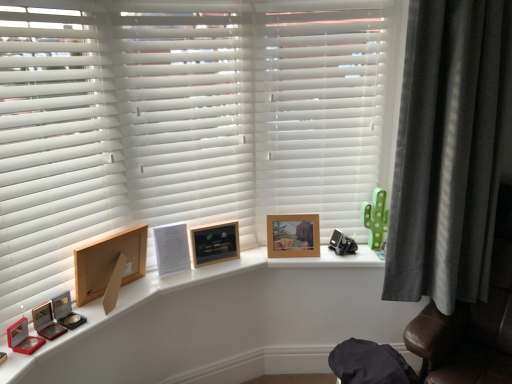
Measure the distance between white matte shutter at left, which ranks as the 3th shutter in right-to-left order, and camera.

A distance of 4.33 feet exists between white matte shutter at left, which ranks as the 3th shutter in right-to-left order, and camera.

The image size is (512, 384). What do you see at coordinates (187, 111) in the screenshot? I see `white matte blinds at center, acting as the 2th shutter starting from the right` at bounding box center [187, 111].

The image size is (512, 384). Describe the element at coordinates (215, 243) in the screenshot. I see `wooden photo frame at center, which appears as the second picture frame when viewed from the front` at that location.

What do you see at coordinates (375, 218) in the screenshot? I see `green polka dot cactus at right` at bounding box center [375, 218].

What is the approximate width of green polka dot cactus at right?

The width of green polka dot cactus at right is 2.47 inches.

Where is `dark grey velvet curtain at right`? This screenshot has width=512, height=384. dark grey velvet curtain at right is located at coordinates (449, 150).

Where is `white matte shutter at left, the 1th shutter from the left`? Image resolution: width=512 pixels, height=384 pixels. white matte shutter at left, the 1th shutter from the left is located at coordinates (52, 153).

Which of these two, dark grey velvet curtain at right or white matte shutter at upper center, arranged as the third shutter when viewed from the left, is smaller?

white matte shutter at upper center, arranged as the third shutter when viewed from the left.

This screenshot has width=512, height=384. I want to click on the 2nd shutter behind the dark grey velvet curtain at right, starting your count from the anchor, so click(320, 108).

Consider the image. From a real-world perspective, between dark grey velvet curtain at right and white matte shutter at upper center, arranged as the third shutter when viewed from the left, who is vertically lower?

dark grey velvet curtain at right is physically lower.

Would you consider dark grey velvet curtain at right to be distant from white matte shutter at upper center, arranged as the third shutter when viewed from the left?

No, dark grey velvet curtain at right is not far away from white matte shutter at upper center, arranged as the third shutter when viewed from the left.

Is white matte shutter at left, which ranks as the 3th shutter in right-to-left order, at the right side of brown leather swivel chair at right?

In fact, white matte shutter at left, which ranks as the 3th shutter in right-to-left order, is to the left of brown leather swivel chair at right.

From the image's perspective, is white matte shutter at left, which ranks as the 3th shutter in right-to-left order, above or below brown leather swivel chair at right?

white matte shutter at left, which ranks as the 3th shutter in right-to-left order, is situated higher than brown leather swivel chair at right in the image.

I want to click on swivel chair located below the white matte shutter at left, the 1th shutter from the left (from the image's perspective), so click(472, 322).

From a real-world perspective, is white matte shutter at left, the 1th shutter from the left, beneath brown leather swivel chair at right?

Incorrect, from a real-world perspective, white matte shutter at left, the 1th shutter from the left, is higher than brown leather swivel chair at right.

Starting from the wooden photo frame at center, which is the first picture frame in back-to-front order, which shutter is the 1st one in front? Please provide its 2D coordinates.

[(320, 108)]

From the picture: Does wooden photo frame at center, which appears as the third picture frame when viewed from the front, come behind white matte shutter at upper center, arranged as the third shutter when viewed from the left?

Yes, wooden photo frame at center, which appears as the third picture frame when viewed from the front, is further from the camera.

Between wooden photo frame at center, acting as the 3th picture frame starting from the left, and white matte shutter at upper center, arranged as the third shutter when viewed from the left, which one has smaller width?

wooden photo frame at center, acting as the 3th picture frame starting from the left, is thinner.

Who is bigger, wooden photo frame at center, which appears as the third picture frame when viewed from the front, or white matte shutter at upper center, arranged as the third shutter when viewed from the left?

With larger size is white matte shutter at upper center, arranged as the third shutter when viewed from the left.

Measure the distance between white matte shutter at upper center, the 1th shutter from the right, and dark grey velvet curtain at right.

white matte shutter at upper center, the 1th shutter from the right, is 14.99 inches away from dark grey velvet curtain at right.

Visually, is white matte shutter at upper center, arranged as the third shutter when viewed from the left, positioned to the left or to the right of dark grey velvet curtain at right?

In the image, white matte shutter at upper center, arranged as the third shutter when viewed from the left, appears on the left side of dark grey velvet curtain at right.

Where is `curtain below the white matte shutter at upper center, arranged as the third shutter when viewed from the left (from the image's perspective)`? curtain below the white matte shutter at upper center, arranged as the third shutter when viewed from the left (from the image's perspective) is located at coordinates (449, 150).

Is white matte shutter at upper center, arranged as the third shutter when viewed from the left, far from dark grey velvet curtain at right?

That's not correct — white matte shutter at upper center, arranged as the third shutter when viewed from the left, is a little close to dark grey velvet curtain at right.

Where is `computer desk below the wooden photo frame at center, the 2th picture frame from the right (from the image's perspective)`? The image size is (512, 384). computer desk below the wooden photo frame at center, the 2th picture frame from the right (from the image's perspective) is located at coordinates (221, 323).

Is wooden photo frame at center, the 2th picture frame from the right, aimed at wooden frame at upper center?

Yes, wooden photo frame at center, the 2th picture frame from the right, is oriented towards wooden frame at upper center.

Who is smaller, wooden photo frame at center, the second picture frame in the back-to-front sequence, or wooden frame at upper center?

With smaller size is wooden photo frame at center, the second picture frame in the back-to-front sequence.

Is wooden photo frame at center, the second picture frame in the left-to-right sequence, wider than wooden frame at upper center?

In fact, wooden photo frame at center, the second picture frame in the left-to-right sequence, might be narrower than wooden frame at upper center.

In the scene shown: Considering the relative sizes of wooden photo frame at center, which is the first picture frame in back-to-front order, and wooden photo frame at center, which appears as the second picture frame when viewed from the front, in the image provided, is wooden photo frame at center, which is the first picture frame in back-to-front order, shorter than wooden photo frame at center, which appears as the second picture frame when viewed from the front,?

Incorrect, the height of wooden photo frame at center, which is the first picture frame in back-to-front order, does not fall short of that of wooden photo frame at center, which appears as the second picture frame when viewed from the front.

Is wooden photo frame at center, the first picture frame positioned from the right, looking in the opposite direction of wooden photo frame at center, which appears as the second picture frame when viewed from the front?

No.

In the image, is wooden photo frame at center, acting as the 3th picture frame starting from the left, on the left side or the right side of wooden photo frame at center, which appears as the second picture frame when viewed from the front?

wooden photo frame at center, acting as the 3th picture frame starting from the left, is to the right of wooden photo frame at center, which appears as the second picture frame when viewed from the front.

Are wooden photo frame at center, which appears as the third picture frame when viewed from the front, and white matte shutter at left, the 1th shutter from the left, far apart?

No, there isn't a large distance between wooden photo frame at center, which appears as the third picture frame when viewed from the front, and white matte shutter at left, the 1th shutter from the left.

Does wooden photo frame at center, the first picture frame positioned from the right, have a lesser height compared to white matte shutter at left, which ranks as the 3th shutter in right-to-left order?

Indeed, wooden photo frame at center, the first picture frame positioned from the right, has a lesser height compared to white matte shutter at left, which ranks as the 3th shutter in right-to-left order.

Considering the positions of objects wooden photo frame at center, acting as the 3th picture frame starting from the left, and white matte shutter at left, which ranks as the 3th shutter in right-to-left order, in the image provided, who is more to the right, wooden photo frame at center, acting as the 3th picture frame starting from the left, or white matte shutter at left, which ranks as the 3th shutter in right-to-left order,?

From the viewer's perspective, wooden photo frame at center, acting as the 3th picture frame starting from the left, appears more on the right side.

The image size is (512, 384). I want to click on the 2nd shutter behind the dark grey velvet curtain at right, so click(320, 108).

There is a brown leather swivel chair at right. Where is `the 1st shutter above it (from the image's perspective)`? The image size is (512, 384). the 1st shutter above it (from the image's perspective) is located at coordinates (52, 153).

Estimate the real-world distances between objects in this image. Which object is closer to white matte blinds at center, acting as the 2th shutter starting from the right, dark grey velvet curtain at right or white matte shutter at left, the 1th shutter from the left?

Based on the image, white matte shutter at left, the 1th shutter from the left, appears to be nearer to white matte blinds at center, acting as the 2th shutter starting from the right.

When comparing their distances from white matte blinds at center, acting as the 2th shutter starting from the left, does white matte shutter at upper center, the 1th shutter from the right, or green polka dot cactus at right seem further?

green polka dot cactus at right lies further to white matte blinds at center, acting as the 2th shutter starting from the left, than the other object.

Estimate the real-world distances between objects in this image. Which object is further from wooden frame at upper center, white matte blinds at center, acting as the 2th shutter starting from the right, or green polka dot cactus at right?

Based on the image, green polka dot cactus at right appears to be further to wooden frame at upper center.

From the image, which object appears to be farther from brown leather swivel chair at right, dark grey velvet curtain at right or green polka dot cactus at right?

green polka dot cactus at right lies further to brown leather swivel chair at right than the other object.

When comparing their distances from wooden picture frame at left, which is counted as the first picture frame, starting from the front, does white matte shutter at left, which ranks as the 3th shutter in right-to-left order, or white matte shutter at upper center, arranged as the third shutter when viewed from the left, seem closer?

white matte shutter at left, which ranks as the 3th shutter in right-to-left order, is positioned closer to the anchor wooden picture frame at left, which is counted as the first picture frame, starting from the front.

When comparing their distances from wooden frame at upper center, does white matte shutter at left, the 1th shutter from the left, or dark grey velvet curtain at right seem closer?

The object closer to wooden frame at upper center is white matte shutter at left, the 1th shutter from the left.

From the image, which object appears to be nearer to brown leather swivel chair at right, dark grey velvet curtain at right or wooden photo frame at center, the first picture frame positioned from the right?

dark grey velvet curtain at right.

Looking at the image, which one is located further to wooden frame at upper center, dark grey velvet curtain at right or wooden photo frame at center, the 2th picture frame from the right?

The object further to wooden frame at upper center is dark grey velvet curtain at right.

I want to click on shutter located between white matte blinds at center, acting as the 2th shutter starting from the left, and brown leather swivel chair at right in the left-right direction, so click(320, 108).

Where is `toy between wooden picture frame at left, which is the third picture frame from back to front, and brown leather swivel chair at right`? The width and height of the screenshot is (512, 384). toy between wooden picture frame at left, which is the third picture frame from back to front, and brown leather swivel chair at right is located at coordinates (375, 218).

Where is `computer desk located between white matte blinds at center, acting as the 2th shutter starting from the right, and brown leather swivel chair at right in the left-right direction`? Image resolution: width=512 pixels, height=384 pixels. computer desk located between white matte blinds at center, acting as the 2th shutter starting from the right, and brown leather swivel chair at right in the left-right direction is located at coordinates (221, 323).

Identify the location of curtain positioned between wooden frame at upper center and wooden photo frame at center, the first picture frame positioned from the right, from near to far. (449, 150).